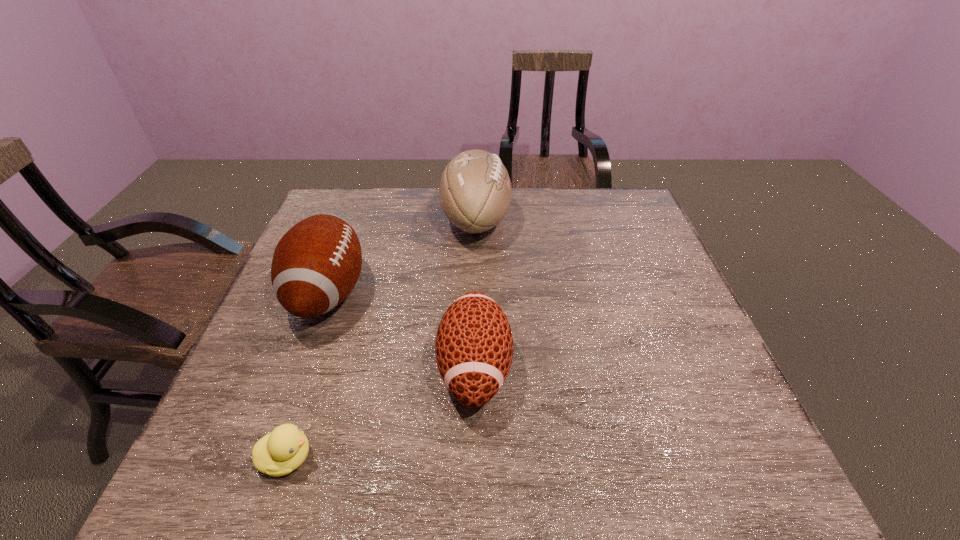
This screenshot has height=540, width=960. Find the location of `duckling that is positioned at the left edge`. duckling that is positioned at the left edge is located at coordinates (278, 453).

At what (x,y) coordinates should I click in order to perform the action: click on object situated at the near left corner. Please return your answer as a coordinate pair (x, y). The width and height of the screenshot is (960, 540). Looking at the image, I should click on (278, 453).

Where is `vacant position at the far edge of the desktop`? This screenshot has height=540, width=960. vacant position at the far edge of the desktop is located at coordinates (541, 204).

In the image, there is a desktop. Where is `free region at the left edge`? The image size is (960, 540). free region at the left edge is located at coordinates (303, 334).

Locate an element on the screen. vacant position at the right edge of the desktop is located at coordinates (648, 262).

In order to click on vacant space at the far left corner of the desktop in this screenshot , I will do `click(359, 198)`.

Identify the location of unoccupied area between the second shortest object and the leftmost football. (401, 330).

Identify the location of vacant space that's between the shortest football and the leftmost football. (401, 330).

Image resolution: width=960 pixels, height=540 pixels. In order to click on unoccupied area between the nearest object and the shortest football in this screenshot , I will do `click(381, 413)`.

Find the location of `vacant area that lies between the shortest object and the third tallest object`. vacant area that lies between the shortest object and the third tallest object is located at coordinates (381, 413).